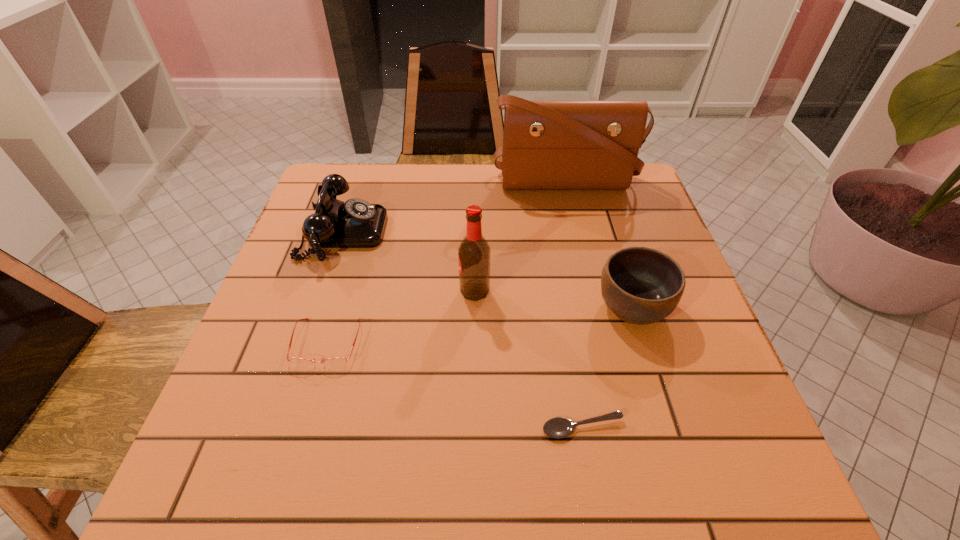
I want to click on vacant position located 0.150m on the back of the second tallest object, so click(475, 237).

At what (x,y) coordinates should I click in order to perform the action: click on vacant area situated 0.330m on the dial of the telephone. Please return your answer as a coordinate pair (x, y). The height and width of the screenshot is (540, 960). Looking at the image, I should click on (516, 232).

Locate an element on the screen. free region located 0.100m on the front of the bowl is located at coordinates (656, 382).

At what (x,y) coordinates should I click in order to perform the action: click on vacant area situated on the lenses of the fifth tallest object. Please return your answer as a coordinate pair (x, y). The image size is (960, 540). Looking at the image, I should click on (301, 430).

Where is `free space located on the left of the nearest object`? free space located on the left of the nearest object is located at coordinates (324, 428).

Locate an element on the screen. Image resolution: width=960 pixels, height=540 pixels. satchel present at the far edge is located at coordinates (547, 144).

I want to click on telephone situated at the far edge, so click(356, 223).

Where is `object located at the near edge`? object located at the near edge is located at coordinates (558, 427).

Locate an element on the screen. telephone that is at the left edge is located at coordinates (356, 223).

At what (x,y) coordinates should I click in order to perform the action: click on spectacles that is at the left edge. Please return your answer as a coordinate pair (x, y). Image resolution: width=960 pixels, height=540 pixels. Looking at the image, I should click on (338, 361).